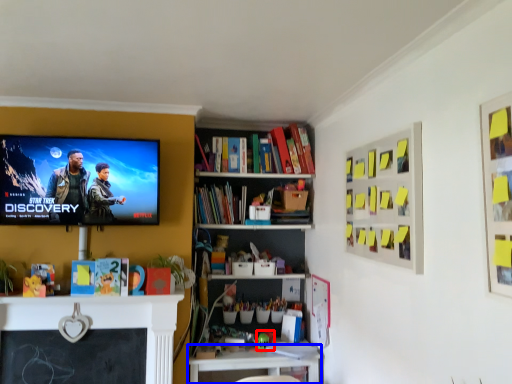
Question: Which object appears farthest to the camera in this image, toy (highlighted by a red box) or table (highlighted by a blue box)?

Choices:
 (A) toy
 (B) table

Answer: (A)